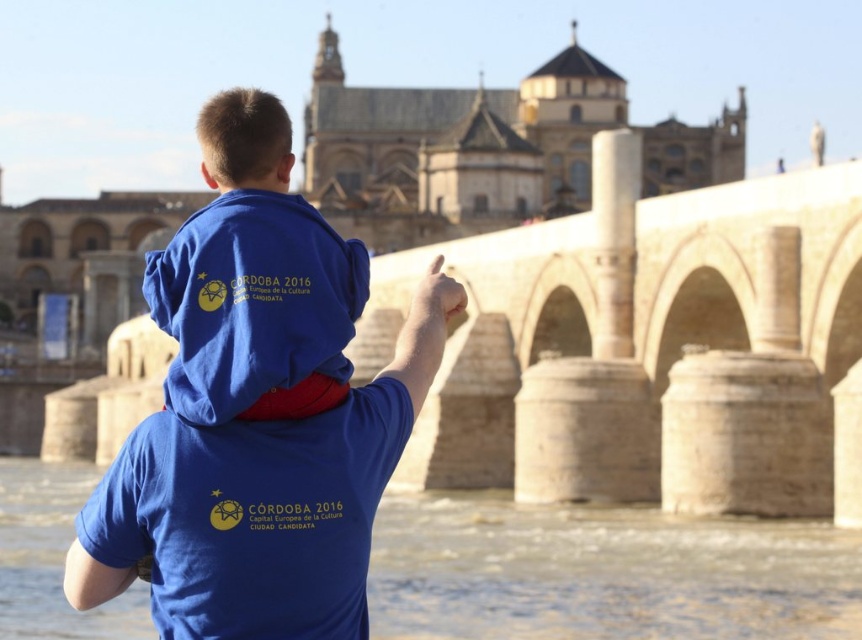
You are a photographer standing at the Roman Bridge of Cordoba. You want to take a photo of the blue cotton shirt at center and the brown stone river at lower center in the same frame. Can you fit both objects in the photo without moving your position? Explain your reasoning.

The blue cotton shirt at center and the brown stone river at lower center are 15.07 meters apart from each other. Since the distance between them is significant, it is possible to capture both in a single frame by adjusting the camera angle or using a wide enough lens, provided the photographer has a clear line of sight and the camera settings allow for such a composition.

You are a tourist standing in front of the beige stone bridge at center and the blue cotton shirt at center. Which object is closer to you?

The beige stone bridge at center is closer to you because it is positioned further to the viewer than the blue cotton shirt at center.